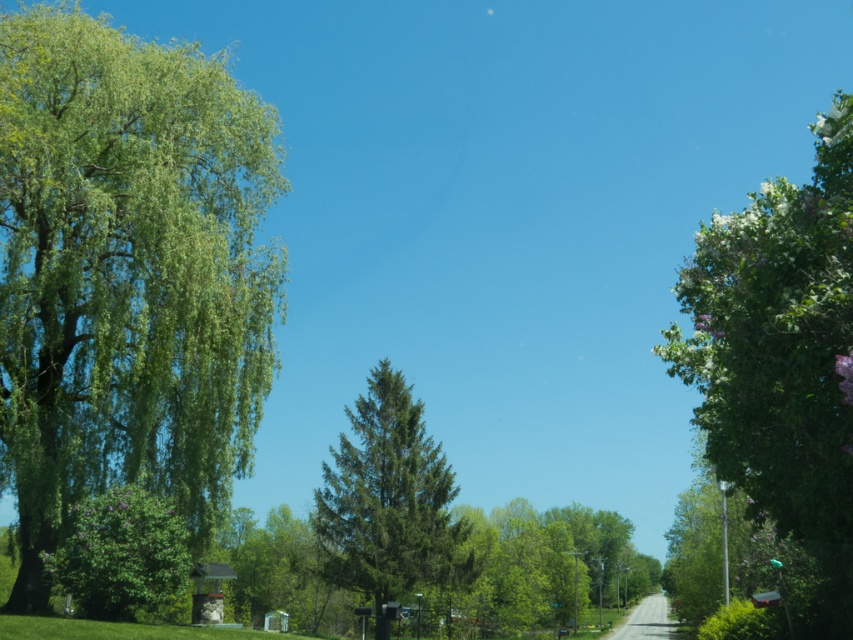
Question: Which of these objects is positioned closest to the green leafy tree at right?

Choices:
 (A) purple leafy tree at center-left
 (B) green leafy tree at left
 (C) green matte tree at center

Answer: (B)

Question: Is green leafy tree at left positioned at the back of green matte tree at center?

Choices:
 (A) no
 (B) yes

Answer: (A)

Question: Is the position of green matte tree at center more distant than that of purple leafy tree at center-left?

Choices:
 (A) no
 (B) yes

Answer: (B)

Question: Does green leafy tree at left appear on the right side of green leafy tree at right?

Choices:
 (A) no
 (B) yes

Answer: (A)

Question: Which object is the closest to the green leafy tree at left?

Choices:
 (A) purple leafy tree at center-left
 (B) green leafy tree at right
 (C) green matte tree at center

Answer: (A)

Question: Which of the following is the closest to the observer?

Choices:
 (A) (426, 520)
 (B) (762, 452)
 (C) (61, 156)

Answer: (B)